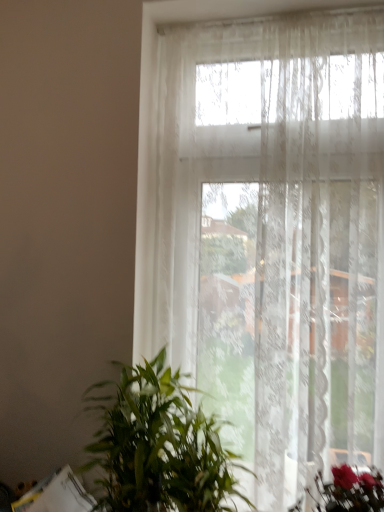
Question: Does green leafy plant at lower left have a lesser height compared to transparent lace curtain at upper center?

Choices:
 (A) yes
 (B) no

Answer: (A)

Question: Is green leafy plant at lower left taller than transparent lace curtain at upper center?

Choices:
 (A) no
 (B) yes

Answer: (A)

Question: Is transparent lace curtain at upper center surrounded by green leafy plant at lower left?

Choices:
 (A) yes
 (B) no

Answer: (B)

Question: Does green leafy plant at lower left lie behind transparent lace curtain at upper center?

Choices:
 (A) no
 (B) yes

Answer: (A)

Question: Considering the relative positions of green leafy plant at lower left and transparent lace curtain at upper center in the image provided, is green leafy plant at lower left to the right of transparent lace curtain at upper center from the viewer's perspective?

Choices:
 (A) yes
 (B) no

Answer: (B)

Question: From the image's perspective, is green leafy plant at lower left over transparent lace curtain at upper center?

Choices:
 (A) no
 (B) yes

Answer: (A)

Question: Is transparent lace curtain at upper center further to camera compared to green leafy plant at lower left?

Choices:
 (A) no
 (B) yes

Answer: (B)

Question: From a real-world perspective, is transparent lace curtain at upper center below green leafy plant at lower left?

Choices:
 (A) no
 (B) yes

Answer: (A)

Question: Is transparent lace curtain at upper center in contact with green leafy plant at lower left?

Choices:
 (A) yes
 (B) no

Answer: (B)

Question: Considering the relative sizes of transparent lace curtain at upper center and green leafy plant at lower left in the image provided, is transparent lace curtain at upper center taller than green leafy plant at lower left?

Choices:
 (A) no
 (B) yes

Answer: (B)

Question: Can you confirm if transparent lace curtain at upper center is smaller than green leafy plant at lower left?

Choices:
 (A) yes
 (B) no

Answer: (B)

Question: Is the depth of transparent lace curtain at upper center less than that of green leafy plant at lower left?

Choices:
 (A) yes
 (B) no

Answer: (B)

Question: From the image's perspective, relative to transparent lace curtain at upper center, is green leafy plant at lower left above or below?

Choices:
 (A) below
 (B) above

Answer: (A)